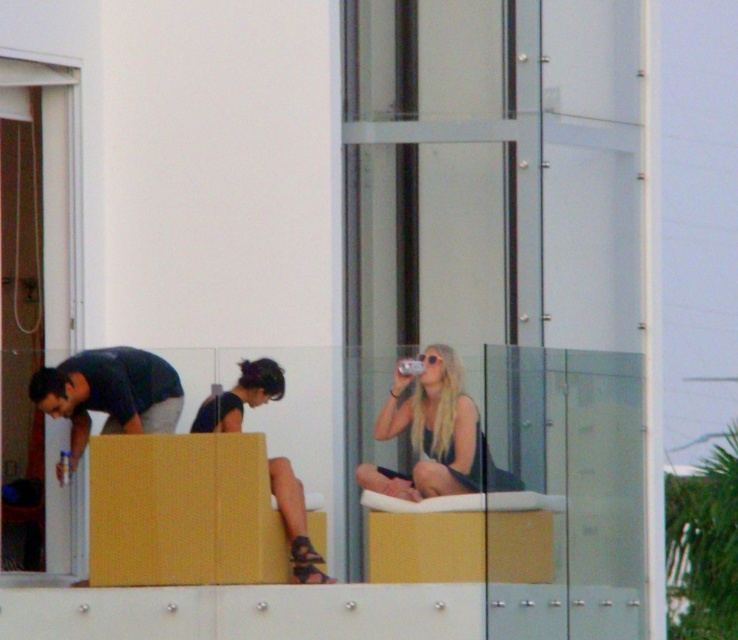
Which of these two, matte black shirt at left or matte black sandals at center, stands taller?

matte black shirt at left

Who is more distant from viewer, (120, 369) or (292, 540)?

The point (120, 369) is more distant.

What are the coordinates of `matte black shirt at left` in the screenshot? It's located at (108, 394).

Does point (424, 477) come behind point (232, 408)?

Yes.

Who is more forward, (x=463, y=417) or (x=272, y=380)?

Point (x=463, y=417) is in front.

I want to click on blonde hair at center, so click(x=434, y=433).

Between blonde hair at center and matte black shirt at left, which one is positioned higher?

Positioned higher is matte black shirt at left.

Which is in front, point (500, 477) or point (179, 384)?

Positioned in front is point (179, 384).

You are a GUI agent. You are given a task and a screenshot of the screen. Output one action in this format:
    pyautogui.click(x=<x>, y=<y>)
    Task: Click on the blonde hair at center
    
    Given the screenshot: What is the action you would take?
    pyautogui.click(x=434, y=433)